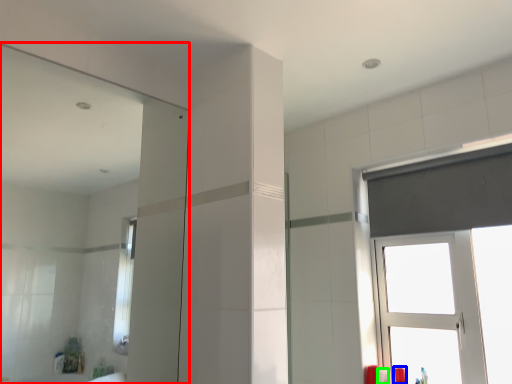
Question: Estimate the real-world distances between objects in this image. Which object is farther from mirror (highlighted by a red box), toiletry (highlighted by a blue box) or toiletry (highlighted by a green box)?

Choices:
 (A) toiletry
 (B) toiletry

Answer: (A)